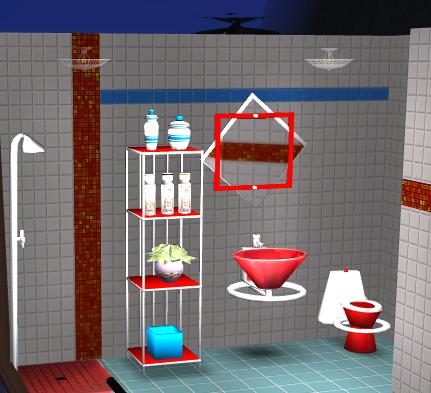
Identify the location of tile. The width and height of the screenshot is (431, 393). (202, 48).